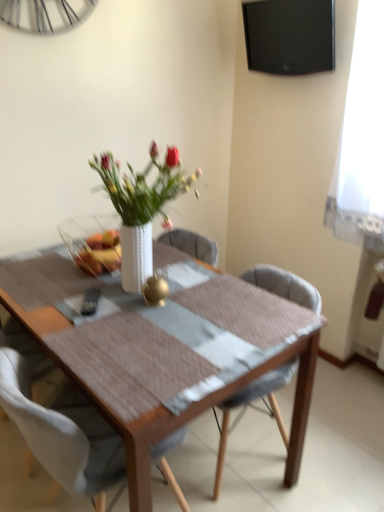
Where is `free space above wooden table at center (from a real-world perspective)`? This screenshot has height=512, width=384. free space above wooden table at center (from a real-world perspective) is located at coordinates (132, 302).